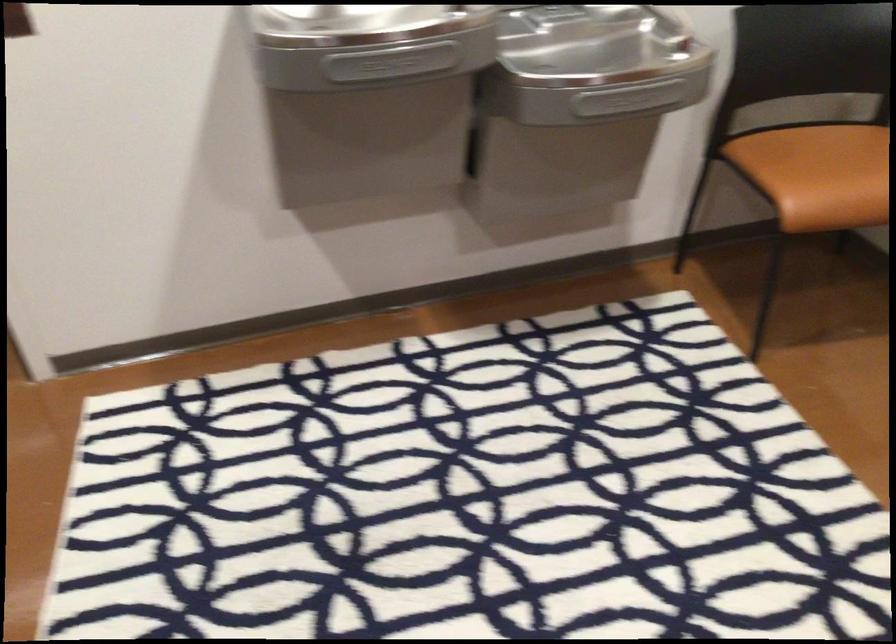
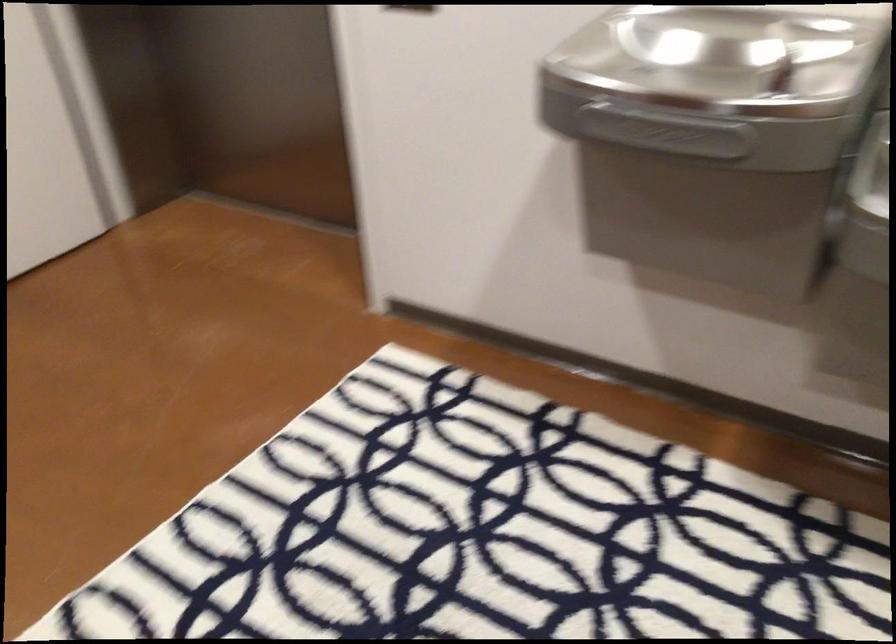
Question: The first image is from the beginning of the video and the second image is from the end. How did the camera likely rotate when shooting the video?

Choices:
 (A) Left
 (B) Right
 (C) Up
 (D) Down

Answer: (A)